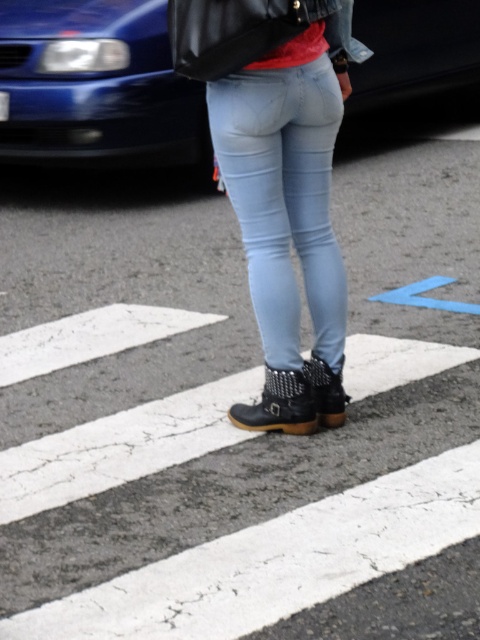
Does light blue denim jeans at center appear on the right side of black textured boot at lower center?

In fact, light blue denim jeans at center is to the left of black textured boot at lower center.

Is point (302, 90) closer to viewer compared to point (327, 412)?

That is True.

Where is `light blue denim jeans at center`? This screenshot has width=480, height=640. light blue denim jeans at center is located at coordinates (284, 198).

Does blue metallic car at upper left have a greater height compared to light blue denim jeans at center?

In fact, blue metallic car at upper left may be shorter than light blue denim jeans at center.

Which is in front, point (28, 74) or point (301, 74)?

Point (301, 74) is in front.

Locate an element on the screen. Image resolution: width=480 pixels, height=640 pixels. blue metallic car at upper left is located at coordinates (96, 84).

The height and width of the screenshot is (640, 480). Describe the element at coordinates (284, 198) in the screenshot. I see `light blue denim jeans at center` at that location.

Who is shorter, light blue denim jeans at center or leather boots at center?

With less height is leather boots at center.

Which is behind, point (290, 298) or point (267, 416)?

The point (267, 416) is more distant.

Find the location of a particular element. Image resolution: width=480 pixels, height=640 pixels. light blue denim jeans at center is located at coordinates (284, 198).